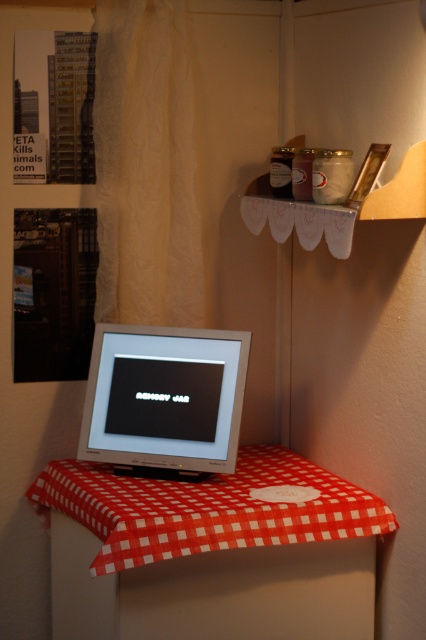
Between point (164, 266) and point (97, 324), which one is positioned behind?

Point (164, 266)

Does beige paper curtain at upper left lie behind satin silver monitor at center?

Yes, it is behind satin silver monitor at center.

Locate an element on the screen. beige paper curtain at upper left is located at coordinates (146, 164).

You are a GUI agent. You are given a task and a screenshot of the screen. Output one action in this format:
    pyautogui.click(x=<x>, y=<y>)
    Task: Click on the beige paper curtain at upper left
    
    Given the screenshot: What is the action you would take?
    pyautogui.click(x=146, y=164)

Does beige paper curtain at upper left have a smaller size compared to red checkered cloth at center?

Yes.

Is beige paper curtain at upper left bigger than red checkered cloth at center?

No, beige paper curtain at upper left is not bigger than red checkered cloth at center.

What are the coordinates of `beige paper curtain at upper left` in the screenshot? It's located at (146, 164).

Image resolution: width=426 pixels, height=640 pixels. In order to click on beige paper curtain at upper left in this screenshot , I will do `click(146, 164)`.

Does red checkered cloth at center appear under satin silver monitor at center?

Yes, red checkered cloth at center is below satin silver monitor at center.

Based on the photo, does red checkered cloth at center have a greater width compared to satin silver monitor at center?

Yes.

Is point (256, 448) farther from camera compared to point (135, 400)?

Yes, point (256, 448) is farther from viewer.

Locate an element on the screen. The width and height of the screenshot is (426, 640). red checkered cloth at center is located at coordinates (206, 508).